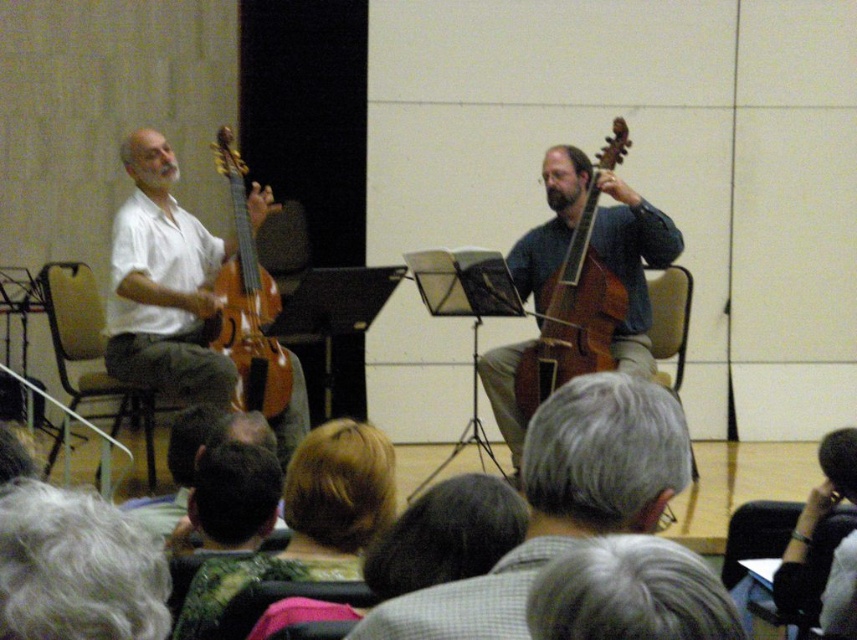
You are a photographer taking a picture of the musicians. You notice the gray hair at upper center and the wooden varnished violin at left. Which object should you adjust to ensure both are in focus? Explain your reasoning.

The gray hair at upper center is not as tall as the wooden varnished violin at left. To ensure both are in focus, you should lower the wooden varnished violin at left so that it aligns in height with the gray hair at upper center, as the difference in height might cause depth of field issues.

You are a stagehand who needs to place a small microphone stand between the gray curly hair at lower left and the black leather glove at lower right. The stand requires at least 2 feet of space to be placed safely. Can you place it there?

The gray curly hair at lower left and the black leather glove at lower right are 6.44 feet apart from each other. Since the microphone stand requires at least 2 feet of space, there is sufficient room to place it between them safely.